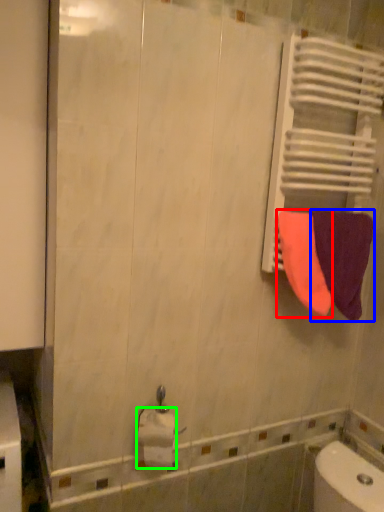
Question: Considering the real-world distances, which object is closest to towel (highlighted by a red box)? towel (highlighted by a blue box) or toilet paper (highlighted by a green box).

Choices:
 (A) towel
 (B) toilet paper

Answer: (A)